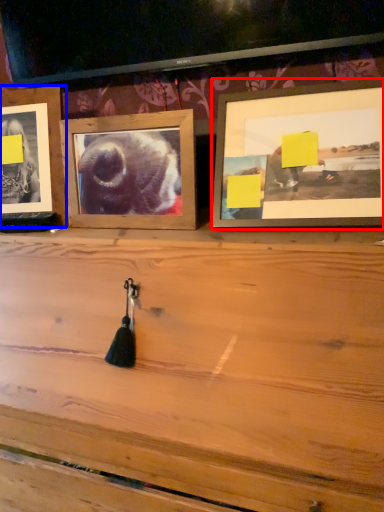
Question: Which object appears closest to the camera in this image, picture frame (highlighted by a red box) or picture frame (highlighted by a blue box)?

Choices:
 (A) picture frame
 (B) picture frame

Answer: (A)